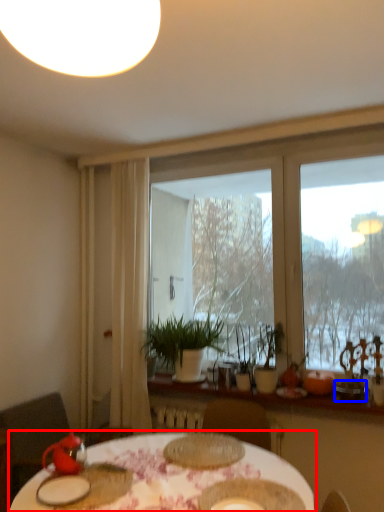
Question: Which point is closer to the camera, table (highlighted by a red box) or tableware (highlighted by a blue box)?

Choices:
 (A) table
 (B) tableware

Answer: (A)